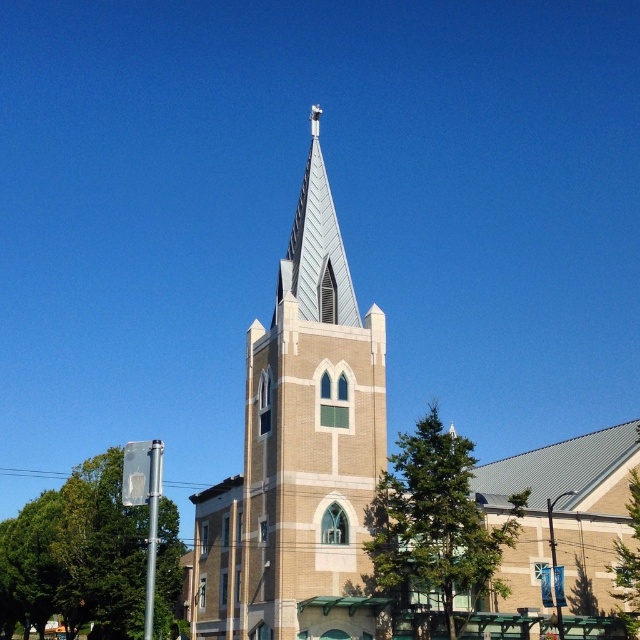
Question: Which of the following is the closest to the observer?

Choices:
 (A) tap(198, 608)
 (B) tap(216, 518)

Answer: (B)

Question: Which object is closer to the camera taking this photo?

Choices:
 (A) metallic silver spire at upper center
 (B) brown brick church steeple at center
 (C) white textured steeple at center

Answer: (C)

Question: Does white textured steeple at center appear on the left side of metallic silver spire at upper center?

Choices:
 (A) yes
 (B) no

Answer: (A)

Question: Does brown brick church steeple at center have a lesser width compared to white textured steeple at center?

Choices:
 (A) yes
 (B) no

Answer: (B)

Question: Is white textured steeple at center positioned at the back of metallic silver spire at upper center?

Choices:
 (A) no
 (B) yes

Answer: (A)

Question: Which point is farther from the camera taking this photo?

Choices:
 (A) (289, 410)
 (B) (314, 248)

Answer: (B)